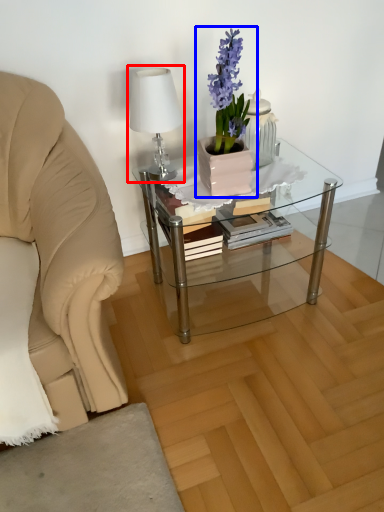
Question: Among these objects, which one is farthest to the camera, table lamp (highlighted by a red box) or houseplant (highlighted by a blue box)?

Choices:
 (A) table lamp
 (B) houseplant

Answer: (A)